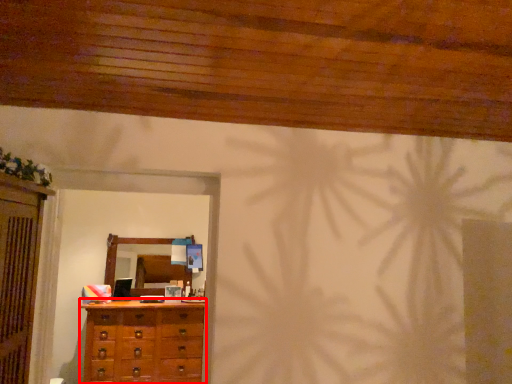
Question: In this image, where is chest of drawers (annotated by the red box) located relative to mirror?

Choices:
 (A) left
 (B) right

Answer: (B)